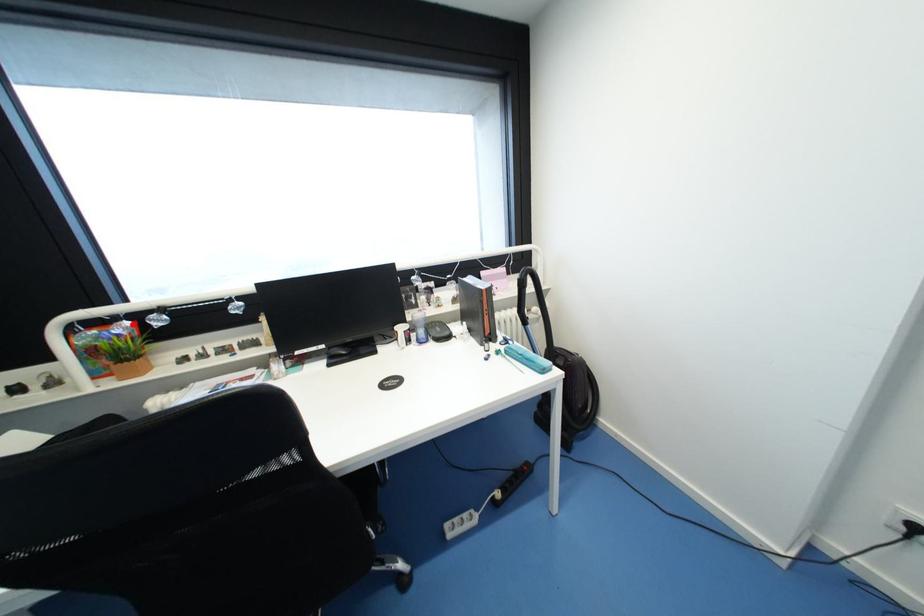
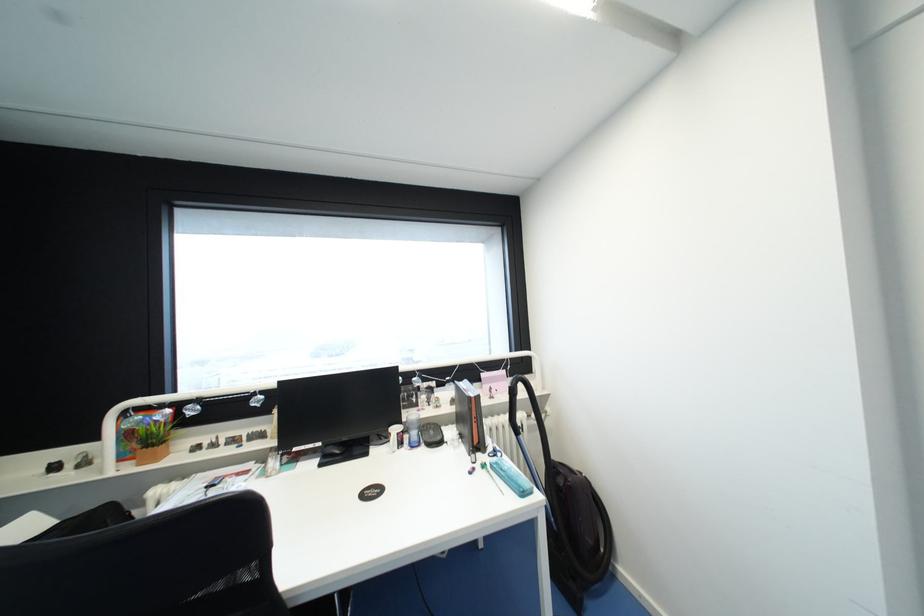
Locate, in the second image, the point that corresponds to the highlighted location in the first image.

(174, 411)